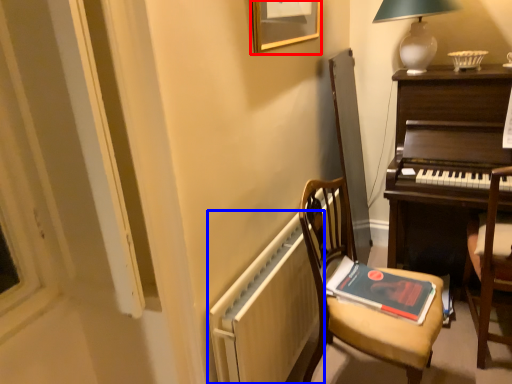
Question: Which point is closer to the camera, picture frame (highlighted by a red box) or radiator (highlighted by a blue box)?

Choices:
 (A) picture frame
 (B) radiator

Answer: (B)